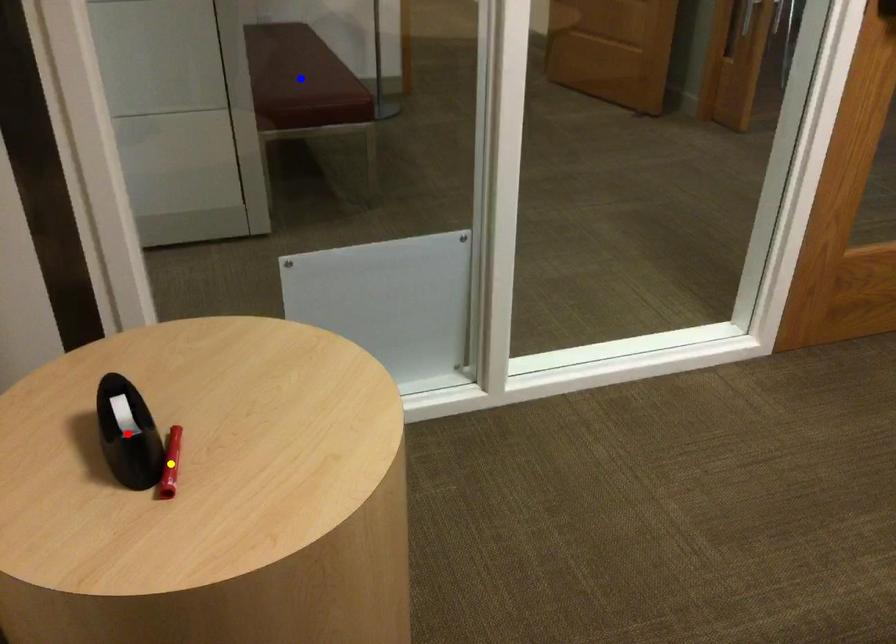
Order these from nearest to farthest:
- red point
- blue point
- yellow point

blue point → yellow point → red point